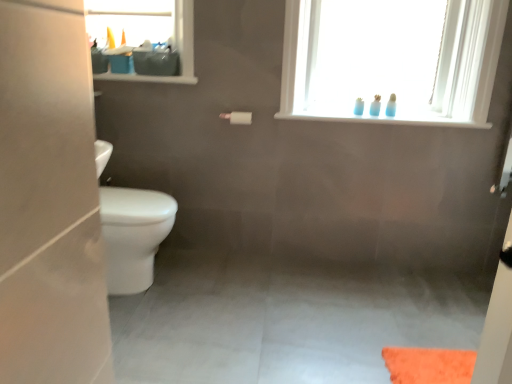
You are a GUI agent. You are given a task and a screenshot of the screen. Output one action in this format:
    pyautogui.click(x=<x>, y=<y>)
    Task: Click on the spots to the right of blue plastic toothbrushes at upper right, the second toiletry from the right
    The width and height of the screenshot is (512, 384).
    Given the screenshot: What is the action you would take?
    pyautogui.click(x=406, y=114)